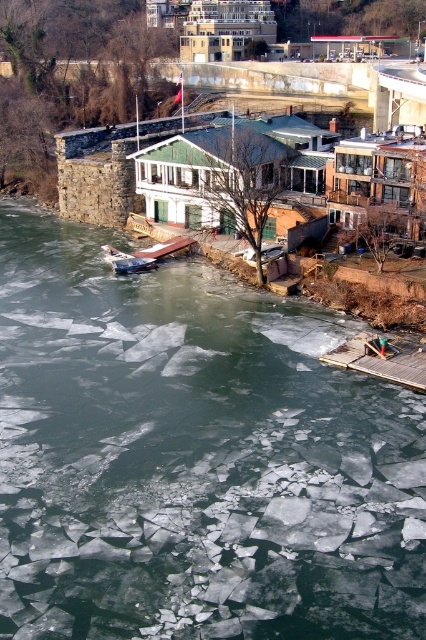
From the picture: Can you confirm if translucent ice at lower center is bigger than metallic silver boat at lower left?

Correct, translucent ice at lower center is larger in size than metallic silver boat at lower left.

Between translucent ice at lower center and metallic silver boat at lower left, which one appears on the left side from the viewer's perspective?

metallic silver boat at lower left is more to the left.

Who is more distant from viewer, (x=340, y=579) or (x=120, y=273)?

The point (x=120, y=273) is behind.

The image size is (426, 640). Find the location of `translucent ice at lower center`. translucent ice at lower center is located at coordinates pyautogui.click(x=192, y=458).